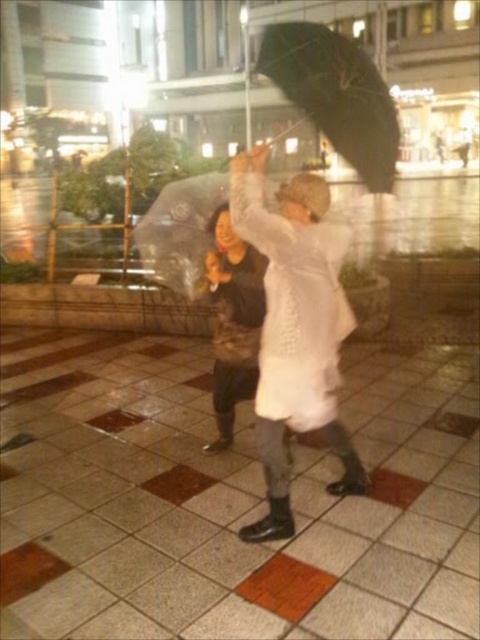
Does point (308, 35) come closer to viewer compared to point (213, 273)?

No, it is behind (213, 273).

Is the position of black matte umbrella at upper center more distant than that of white matte coat at upper center?

That is False.

Who is more distant from viewer, [374,164] or [252,376]?

Positioned behind is point [252,376].

This screenshot has width=480, height=640. Find the location of `black matte umbrella at upper center`. black matte umbrella at upper center is located at coordinates (336, 93).

Can you confirm if white matte coat at center is bigger than black matte umbrella at upper center?

No.

Is white matte coat at center positioned at the back of black matte umbrella at upper center?

No, it is in front of black matte umbrella at upper center.

Is point (309, 380) positioned behind point (357, 131)?

That is False.

The width and height of the screenshot is (480, 640). Identify the location of white matte coat at center. (295, 330).

Does white matte coat at center lie behind white matte coat at upper center?

No, white matte coat at center is closer to the viewer.

From the picture: Who is positioned more to the right, white matte coat at center or white matte coat at upper center?

white matte coat at center

At what (x,y) coordinates should I click in order to perform the action: click on white matte coat at center. Please return your answer as a coordinate pair (x, y). Image resolution: width=480 pixels, height=640 pixels. Looking at the image, I should click on (295, 330).

You are a GUI agent. You are given a task and a screenshot of the screen. Output one action in this format:
    pyautogui.click(x=<x>, y=<y>)
    Task: Click on the white matte coat at center
    The width and height of the screenshot is (480, 640).
    Given the screenshot: What is the action you would take?
    pyautogui.click(x=295, y=330)